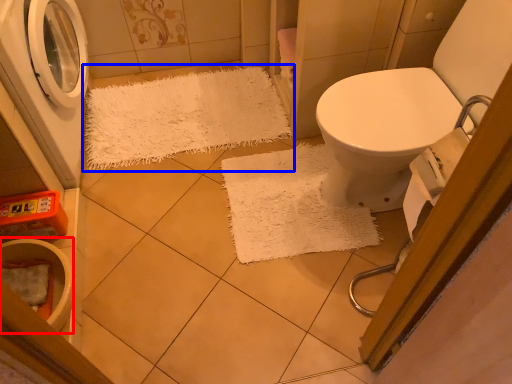
Question: Which point is closer to the camera, toilet bowl (highlighted by a red box) or doormat (highlighted by a blue box)?

Choices:
 (A) toilet bowl
 (B) doormat

Answer: (A)